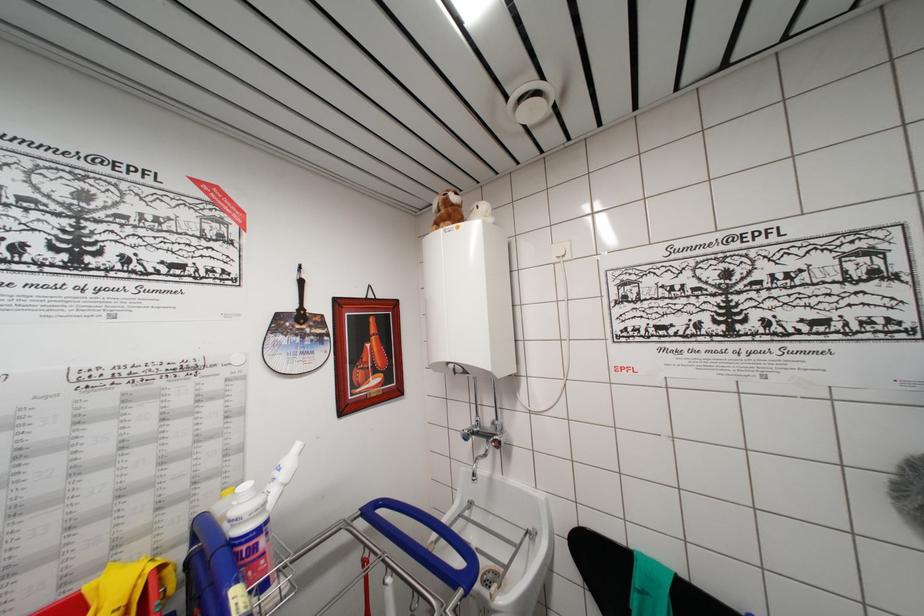
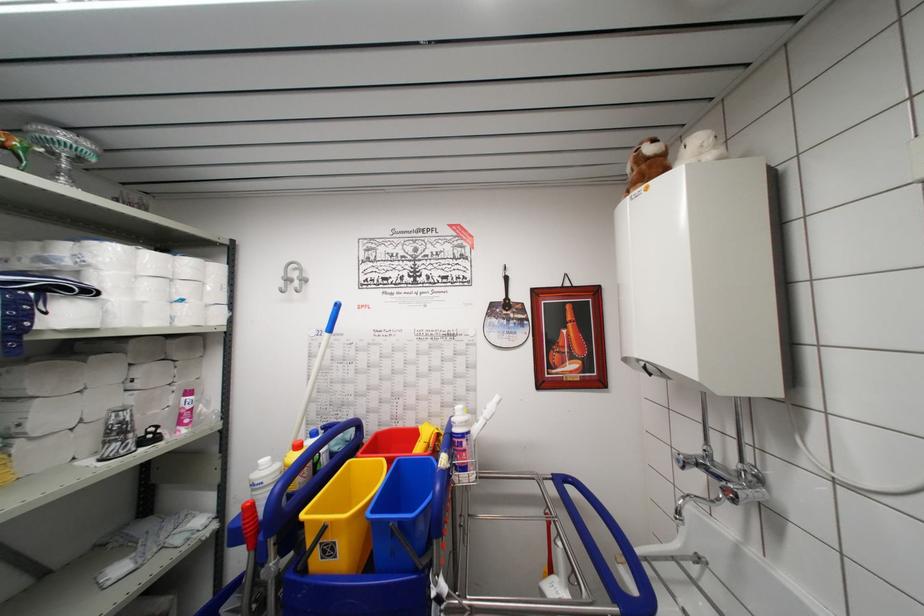
Locate, in the second image, the point that corresponds to pixel 477 480 in the first image.

(681, 517)